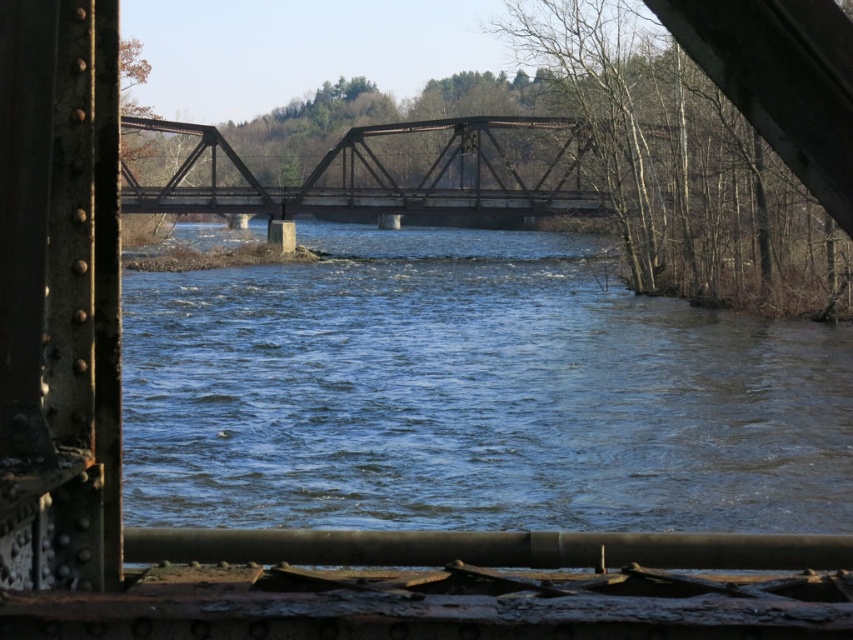
Looking at this image, does blue water at center appear on the left side of rusty metal bridge at center?

Incorrect, blue water at center is not on the left side of rusty metal bridge at center.

Is blue water at center closer to camera compared to rusty metal bridge at center?

Yes, it is.

Between point (787, 440) and point (259, 182), which one is positioned behind?

Positioned behind is point (259, 182).

What are the coordinates of `blue water at center` in the screenshot? It's located at (473, 396).